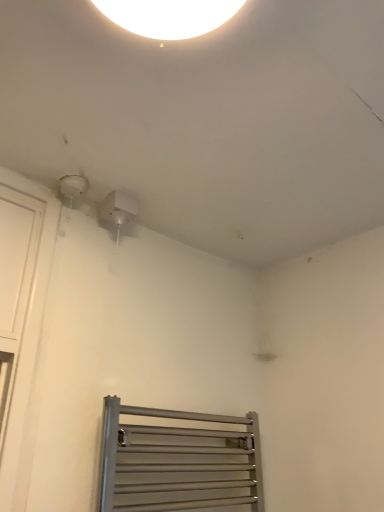
Describe the element at coordinates (118, 210) in the screenshot. I see `white plastic lamp at upper center` at that location.

Locate an element on the screen. white plastic lamp at upper center is located at coordinates pyautogui.click(x=118, y=210).

This screenshot has width=384, height=512. I want to click on white plastic lamp at upper center, so click(x=118, y=210).